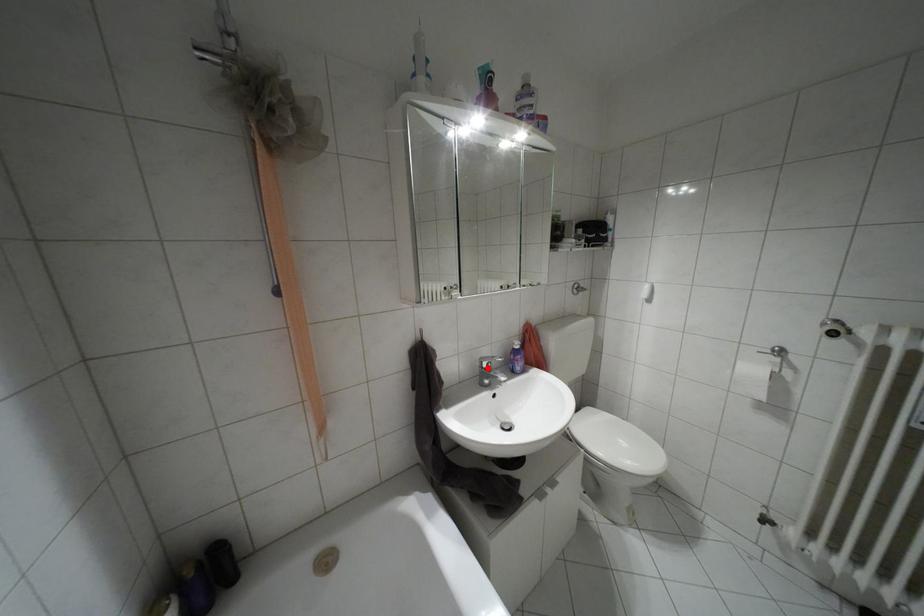
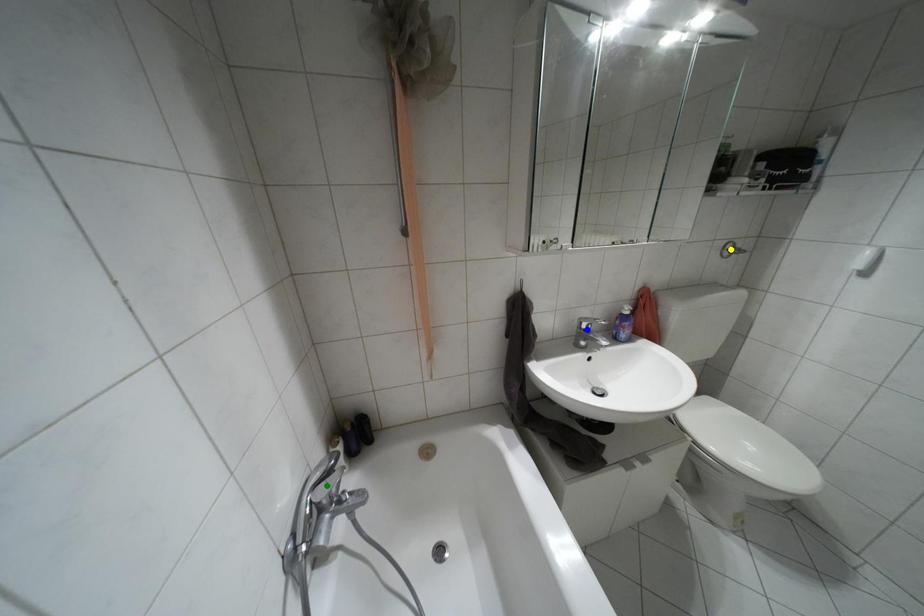
Question: I am providing you with two images of the same scene from different viewpoints. A red point is marked on the first image. You are given multiple points on the second image. Which point in image 2 is actually the same real-world point as the red point in image 1?

Choices:
 (A) blue point
 (B) yellow point
 (C) green point

Answer: (A)